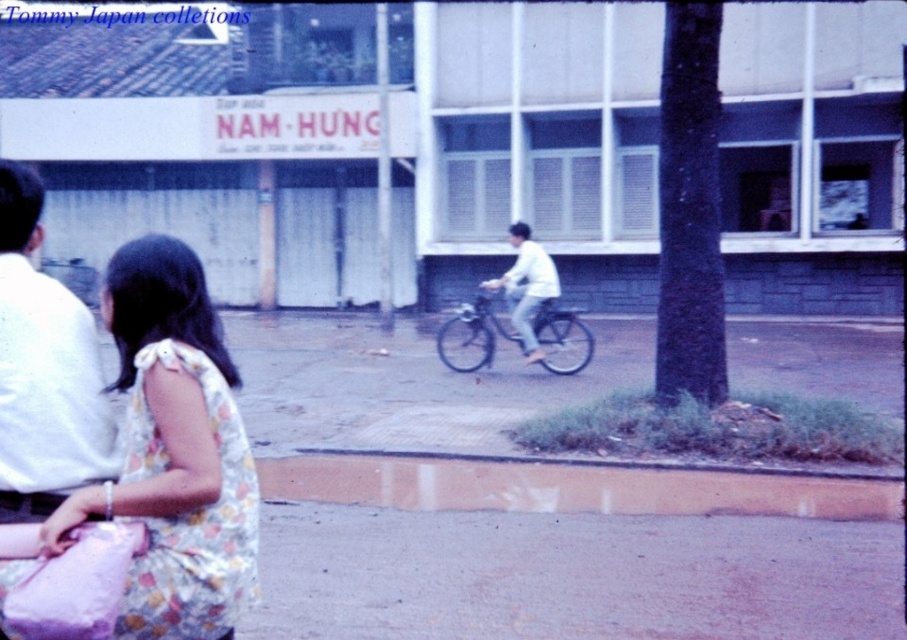
Question: Is floral fabric dress at lower left to the right of white cotton shirt at left from the viewer's perspective?

Choices:
 (A) no
 (B) yes

Answer: (B)

Question: Which is farther from the white cotton shirt at left?

Choices:
 (A) white matte bicycle at center
 (B) metallic silver bicycle at center
 (C) floral fabric dress at lower left

Answer: (B)

Question: Does floral fabric dress at lower left lie behind white cotton shirt at left?

Choices:
 (A) yes
 (B) no

Answer: (B)

Question: Which point appears closest to the camera in this image?

Choices:
 (A) (132, 451)
 (B) (529, 337)

Answer: (A)

Question: Which of these objects is positioned farthest from the metallic silver bicycle at center?

Choices:
 (A) white cotton shirt at left
 (B) floral fabric dress at lower left
 (C) white matte bicycle at center

Answer: (B)

Question: Does white cotton shirt at left have a lesser width compared to white matte bicycle at center?

Choices:
 (A) yes
 (B) no

Answer: (A)